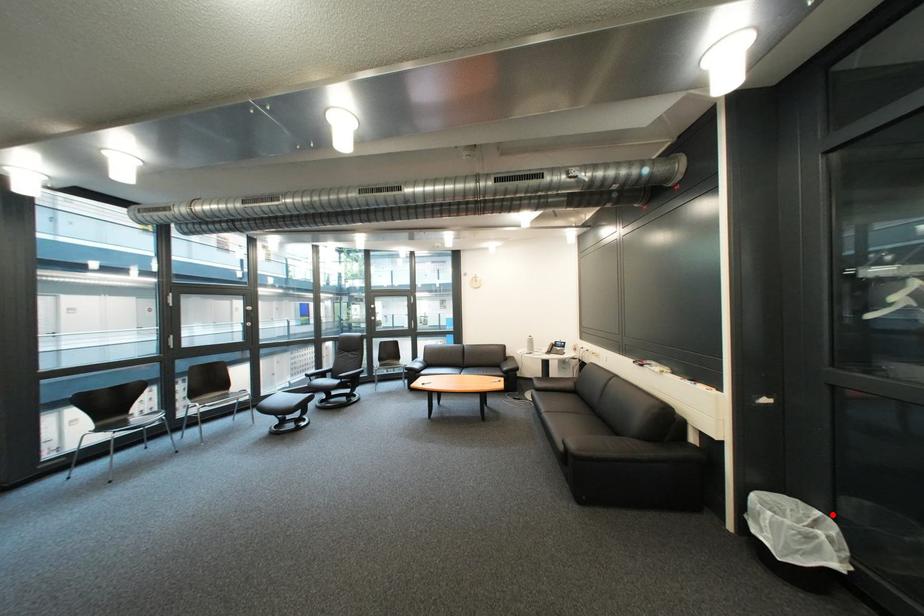
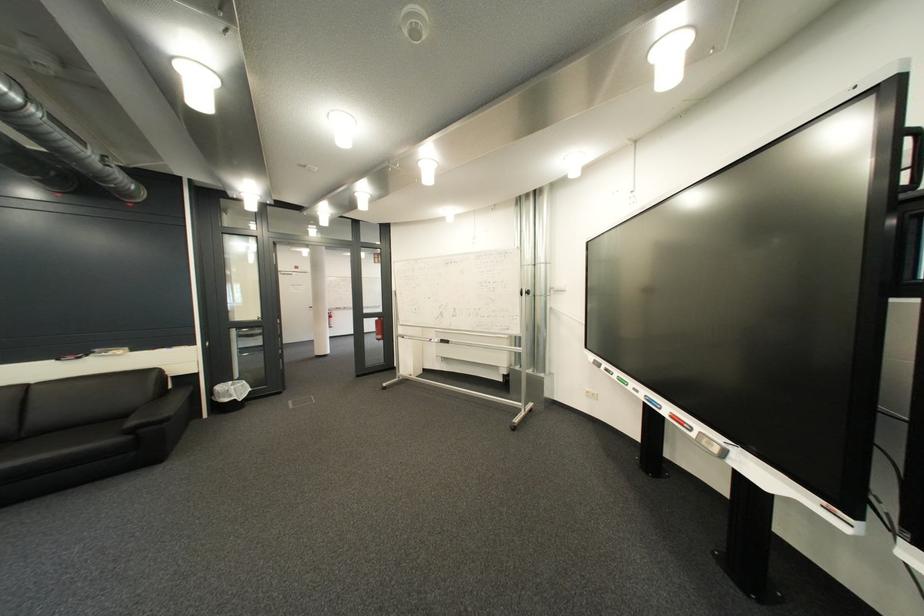
In the second image, find the point that corresponds to the highlighted location in the first image.

(245, 384)